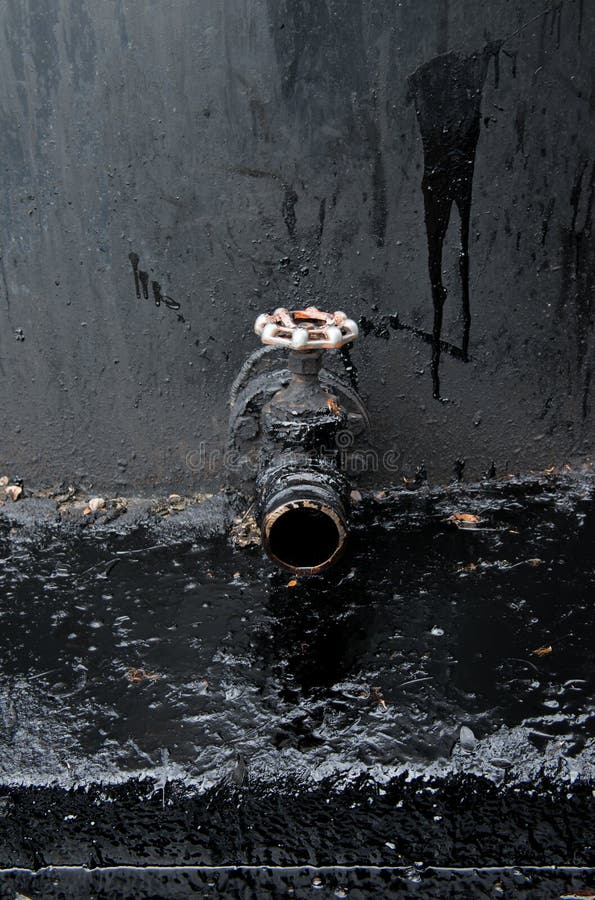
Identify the location of black wall. (317, 56).